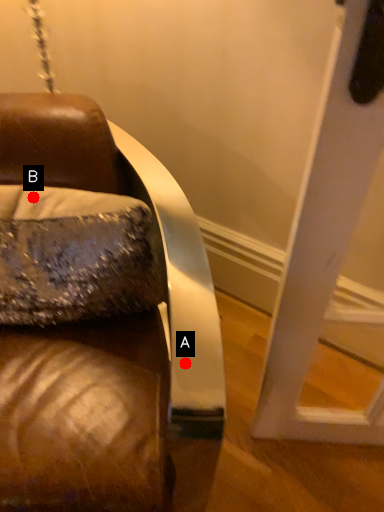
Question: Two points are circled on the image, labeled by A and B beside each circle. Which point appears closest to the camera in this image?

Choices:
 (A) A is closer
 (B) B is closer

Answer: (B)